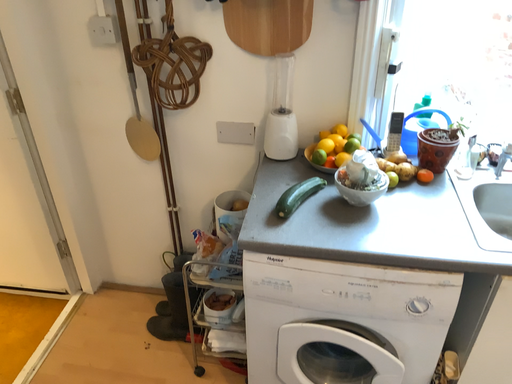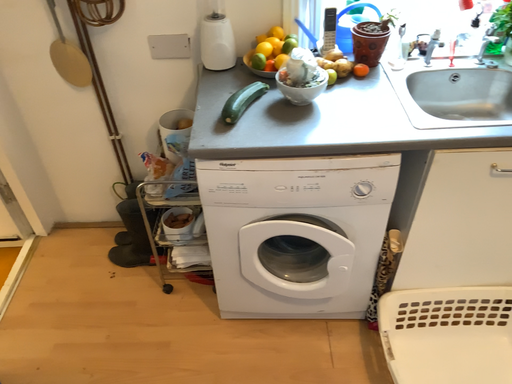
Question: How did the camera likely rotate when shooting the video?

Choices:
 (A) rotated right
 (B) rotated left

Answer: (A)